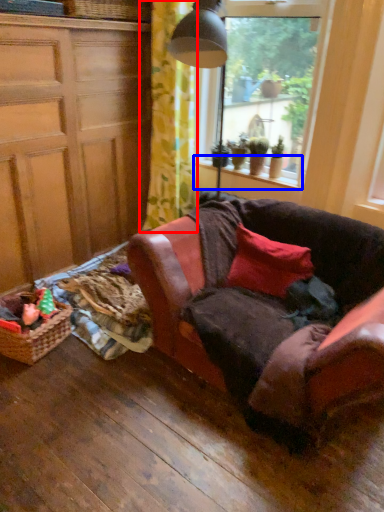
Question: Which object is closer to the camera taking this photo, curtain (highlighted by a red box) or window sill (highlighted by a blue box)?

Choices:
 (A) curtain
 (B) window sill

Answer: (A)